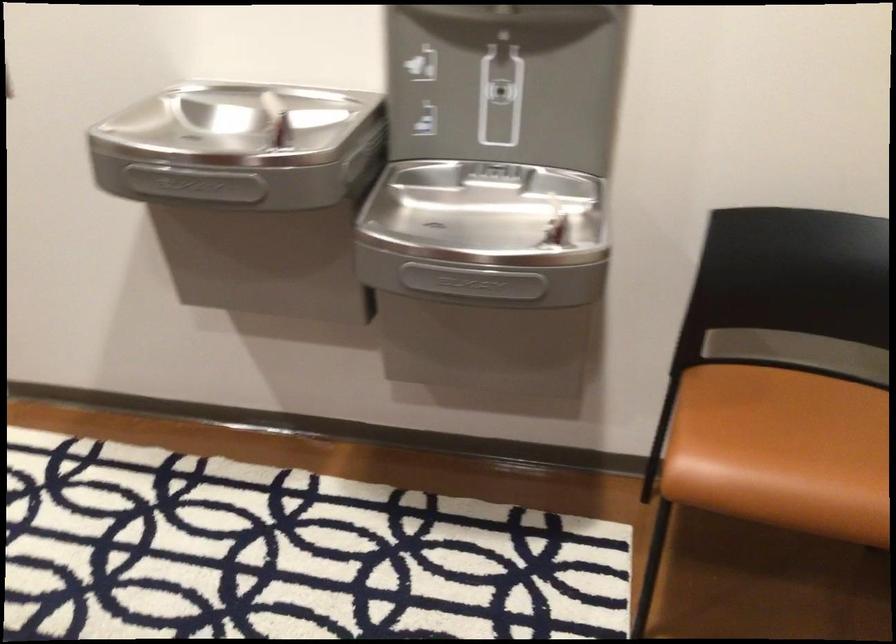
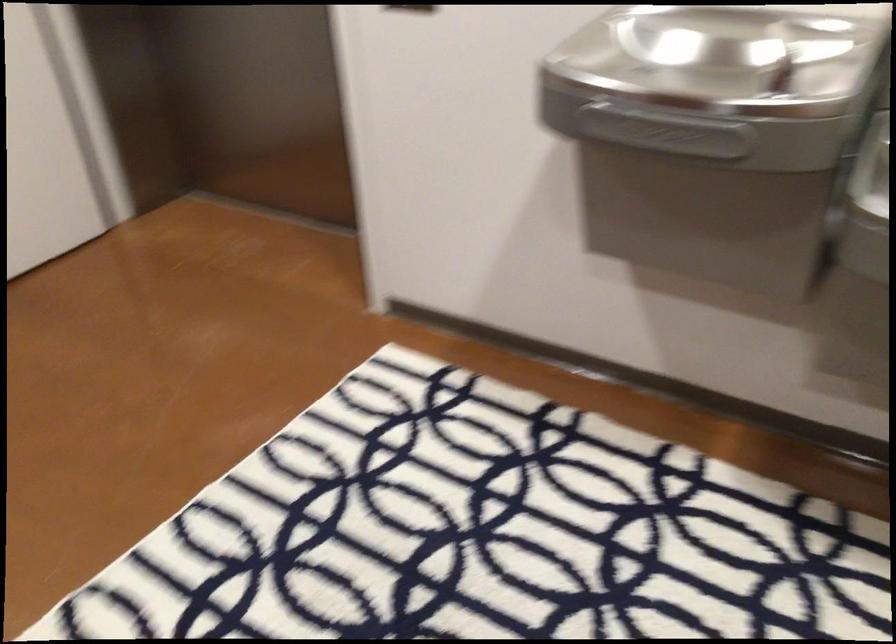
From the picture: The images are taken continuously from a first-person perspective. In which direction are you moving?

The cameraman moved toward left, forward.